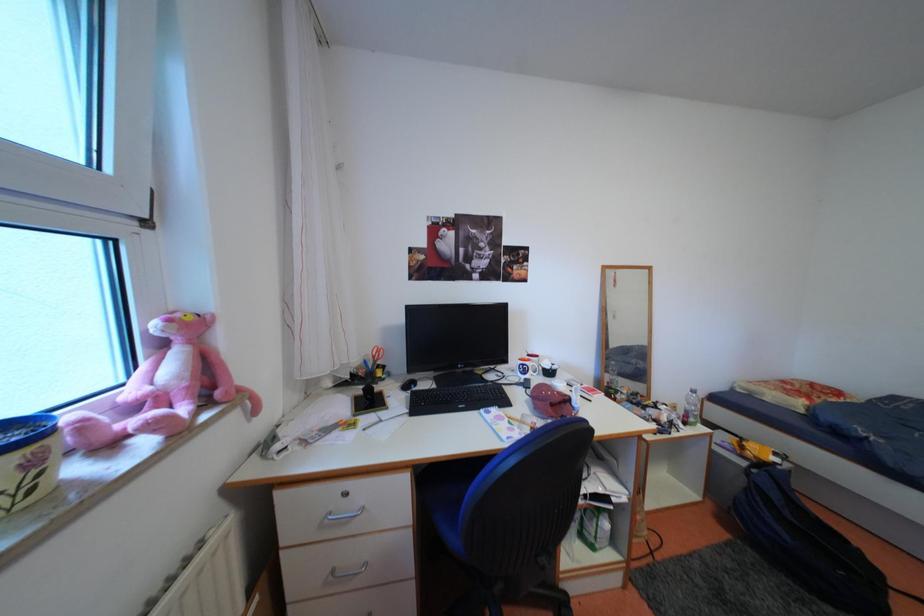
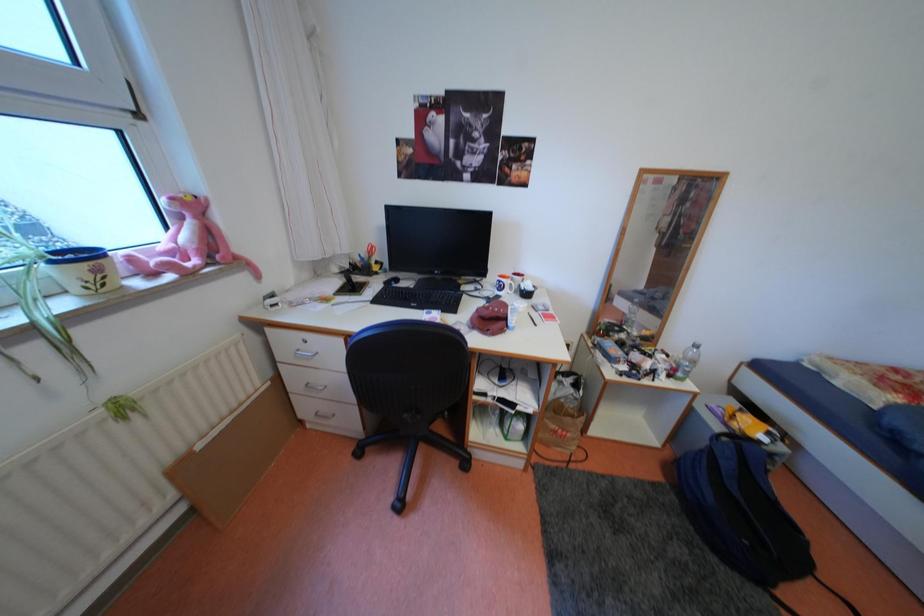
Based on the photo, how did the camera likely rotate?

The rotation direction of the camera is left-down.